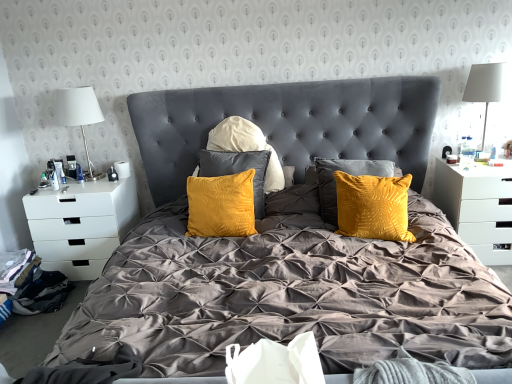
Locate an element on the screen. Image resolution: width=512 pixels, height=384 pixels. white fabric lampshade at upper right, placed as the first table lamp when sorted from right to left is located at coordinates (484, 88).

Locate an element on the screen. The image size is (512, 384). white fabric lampshade at left, which is counted as the first table lamp, starting from the left is located at coordinates (79, 115).

I want to click on white glossy nightstand at right, which is the 1th nightstand from right to left, so click(x=478, y=208).

From a real-world perspective, is black fabric at lower left on top of white glossy nightstand at right, which is the 1th nightstand from right to left?

No, from a real-world perspective, black fabric at lower left is not on top of white glossy nightstand at right, which is the 1th nightstand from right to left.

Which of these two, black fabric at lower left or white glossy nightstand at right, which ranks as the 2th nightstand in left-to-right order, stands taller?

white glossy nightstand at right, which ranks as the 2th nightstand in left-to-right order.

Find the location of `the 2nd nightstand above the black fabric at lower left (from the image's perspective)`. the 2nd nightstand above the black fabric at lower left (from the image's perspective) is located at coordinates (478, 208).

Looking at this image, can white glossy nightstand at right, which is the 1th nightstand from right to left, be found inside black fabric at lower left?

No, white glossy nightstand at right, which is the 1th nightstand from right to left, is not inside black fabric at lower left.

How different are the orientations of white fabric lampshade at upper right, which is the second table lamp from left to right, and velvet yellow pillows at center in degrees?

0.499 degrees separate the facing orientations of white fabric lampshade at upper right, which is the second table lamp from left to right, and velvet yellow pillows at center.

From a real-world perspective, is white fabric lampshade at upper right, which is the second table lamp from left to right, on velvet yellow pillows at center?

Yes, from a real-world perspective, white fabric lampshade at upper right, which is the second table lamp from left to right, is above velvet yellow pillows at center.

From the image's perspective, is white fabric lampshade at upper right, which is the second table lamp from left to right, on top of velvet yellow pillows at center?

Yes, from the image's perspective, white fabric lampshade at upper right, which is the second table lamp from left to right, is over velvet yellow pillows at center.

Do you think white fabric lampshade at upper right, placed as the first table lamp when sorted from right to left, is within velvet yellow pillows at center, or outside of it?

The correct answer is: outside.

Does white fabric lampshade at upper right, which is the second table lamp from left to right, have a greater width compared to white matte drawer at left, which is counted as the second nightstand, starting from the right?

No, white fabric lampshade at upper right, which is the second table lamp from left to right, is not wider than white matte drawer at left, which is counted as the second nightstand, starting from the right.

Which is correct: white fabric lampshade at upper right, placed as the first table lamp when sorted from right to left, is inside white matte drawer at left, which is counted as the second nightstand, starting from the right, or outside of it?

white fabric lampshade at upper right, placed as the first table lamp when sorted from right to left, is not enclosed by white matte drawer at left, which is counted as the second nightstand, starting from the right.

Where is `the 1st table lamp positioned above the white matte drawer at left, which is counted as the second nightstand, starting from the right (from a real-world perspective)`? the 1st table lamp positioned above the white matte drawer at left, which is counted as the second nightstand, starting from the right (from a real-world perspective) is located at coordinates (484, 88).

Who is bigger, white fabric lampshade at upper right, placed as the first table lamp when sorted from right to left, or white matte drawer at left, which is counted as the second nightstand, starting from the right?

Bigger between the two is white matte drawer at left, which is counted as the second nightstand, starting from the right.

Is black fabric at lower left facing away from white fabric lampshade at left, which is counted as the first table lamp, starting from the left?

No, black fabric at lower left is not facing the opposite direction of white fabric lampshade at left, which is counted as the first table lamp, starting from the left.

Considering the sizes of objects black fabric at lower left and white fabric lampshade at left, the 2th table lamp viewed from the right, in the image provided, who is shorter, black fabric at lower left or white fabric lampshade at left, the 2th table lamp viewed from the right,?

With less height is black fabric at lower left.

Is the surface of black fabric at lower left in direct contact with white fabric lampshade at left, which is counted as the first table lamp, starting from the left?

No, black fabric at lower left is not with white fabric lampshade at left, which is counted as the first table lamp, starting from the left.

Is black fabric at lower left not within white fabric lampshade at left, which is counted as the first table lamp, starting from the left?

That's correct, black fabric at lower left is outside of white fabric lampshade at left, which is counted as the first table lamp, starting from the left.

Is white matte drawer at left, which is the first nightstand in left-to-right order, to the left of white fabric lampshade at upper right, placed as the first table lamp when sorted from right to left, from the viewer's perspective?

Correct, you'll find white matte drawer at left, which is the first nightstand in left-to-right order, to the left of white fabric lampshade at upper right, placed as the first table lamp when sorted from right to left.

Is white matte drawer at left, which is the first nightstand in left-to-right order, wider or thinner than white fabric lampshade at upper right, placed as the first table lamp when sorted from right to left?

white matte drawer at left, which is the first nightstand in left-to-right order, is wider than white fabric lampshade at upper right, placed as the first table lamp when sorted from right to left.

From the image's perspective, relative to white fabric lampshade at upper right, which is the second table lamp from left to right, is white matte drawer at left, which is counted as the second nightstand, starting from the right, above or below?

white matte drawer at left, which is counted as the second nightstand, starting from the right, is below white fabric lampshade at upper right, which is the second table lamp from left to right.

The height and width of the screenshot is (384, 512). Find the location of `table lamp in front of the white matte drawer at left, which is the first nightstand in left-to-right order`. table lamp in front of the white matte drawer at left, which is the first nightstand in left-to-right order is located at coordinates (484, 88).

Considering the points (119, 217) and (433, 186), which point is behind, point (119, 217) or point (433, 186)?

The point (433, 186) is farther.

From the image's perspective, is white matte drawer at left, which is counted as the second nightstand, starting from the right, on white glossy nightstand at right, which is the 1th nightstand from right to left?

No.

Between white matte drawer at left, which is counted as the second nightstand, starting from the right, and white glossy nightstand at right, which is the 1th nightstand from right to left, which one has larger width?

→ white glossy nightstand at right, which is the 1th nightstand from right to left.

Is white fabric lampshade at left, the 2th table lamp viewed from the right, at the back of velvet yellow pillows at center?

velvet yellow pillows at center is not turned away from white fabric lampshade at left, the 2th table lamp viewed from the right.

From the image's perspective, which object appears higher, velvet yellow pillows at center or white fabric lampshade at left, the 2th table lamp viewed from the right?

From the image's view, white fabric lampshade at left, the 2th table lamp viewed from the right, is above.

Between velvet yellow pillows at center and white fabric lampshade at left, the 2th table lamp viewed from the right, which one is positioned behind?

white fabric lampshade at left, the 2th table lamp viewed from the right.

Can you tell me how much velvet yellow pillows at center and white fabric lampshade at left, the 2th table lamp viewed from the right, differ in facing direction?

velvet yellow pillows at center and white fabric lampshade at left, the 2th table lamp viewed from the right, are facing 2.89 degrees away from each other.

From a real-world perspective, starting from the black fabric at lower left, which nightstand is the 1st one vertically above it? Please provide its 2D coordinates.

[(478, 208)]

Locate an element on the screen. This screenshot has width=512, height=384. the 1st table lamp behind the velvet yellow pillows at center is located at coordinates (484, 88).

From the image, which object appears to be farther from white fabric lampshade at left, the 2th table lamp viewed from the right, white fabric lampshade at upper right, placed as the first table lamp when sorted from right to left, or white glossy nightstand at right, which is the 1th nightstand from right to left?

The object further to white fabric lampshade at left, the 2th table lamp viewed from the right, is white fabric lampshade at upper right, placed as the first table lamp when sorted from right to left.

Which object lies further to the anchor point white matte drawer at left, which is the first nightstand in left-to-right order, velvet yellow pillows at center or white fabric lampshade at upper right, placed as the first table lamp when sorted from right to left?

white fabric lampshade at upper right, placed as the first table lamp when sorted from right to left, is further to white matte drawer at left, which is the first nightstand in left-to-right order.

Looking at the image, which one is located closer to white fabric lampshade at left, which is counted as the first table lamp, starting from the left, white matte drawer at left, which is counted as the second nightstand, starting from the right, or white glossy nightstand at right, which is the 1th nightstand from right to left?

white matte drawer at left, which is counted as the second nightstand, starting from the right.

From the picture: When comparing their distances from white fabric lampshade at left, which is counted as the first table lamp, starting from the left, does white fabric lampshade at upper right, which is the second table lamp from left to right, or black fabric at lower left seem further?

Based on the image, white fabric lampshade at upper right, which is the second table lamp from left to right, appears to be further to white fabric lampshade at left, which is counted as the first table lamp, starting from the left.

Which object lies further to the anchor point white fabric lampshade at left, which is counted as the first table lamp, starting from the left, black fabric at lower left or white matte drawer at left, which is the first nightstand in left-to-right order?

Among the two, black fabric at lower left is located further to white fabric lampshade at left, which is counted as the first table lamp, starting from the left.

Which object lies further to the anchor point velvet yellow pillows at center, white fabric lampshade at left, which is counted as the first table lamp, starting from the left, or white matte drawer at left, which is counted as the second nightstand, starting from the right?

white fabric lampshade at left, which is counted as the first table lamp, starting from the left, is positioned further to the anchor velvet yellow pillows at center.

Based on the photo, considering their positions, is white fabric lampshade at upper right, placed as the first table lamp when sorted from right to left, positioned closer to black fabric at lower left than white glossy nightstand at right, which is the 1th nightstand from right to left?

The object closer to black fabric at lower left is white glossy nightstand at right, which is the 1th nightstand from right to left.

Based on the photo, based on their spatial positions, is white glossy nightstand at right, which is the 1th nightstand from right to left, or white fabric lampshade at upper right, placed as the first table lamp when sorted from right to left, further from white matte drawer at left, which is counted as the second nightstand, starting from the right?

The object further to white matte drawer at left, which is counted as the second nightstand, starting from the right, is white fabric lampshade at upper right, placed as the first table lamp when sorted from right to left.

At what (x,y) coordinates should I click in order to perform the action: click on bed between black fabric at lower left and white glossy nightstand at right, which ranks as the 2th nightstand in left-to-right order, from left to right. Please return your answer as a coordinate pair (x, y). The height and width of the screenshot is (384, 512). Looking at the image, I should click on (275, 239).

Find the location of a particular element. material between velvet yellow pillows at center and white matte drawer at left, which is counted as the second nightstand, starting from the right, from front to back is located at coordinates (29, 285).

Image resolution: width=512 pixels, height=384 pixels. I want to click on bed between white fabric lampshade at left, which is counted as the first table lamp, starting from the left, and white fabric lampshade at upper right, which is the second table lamp from left to right, in the horizontal direction, so click(x=275, y=239).

At what (x,y) coordinates should I click in order to perform the action: click on table lamp between black fabric at lower left and white fabric lampshade at upper right, placed as the first table lamp when sorted from right to left, in the horizontal direction. Please return your answer as a coordinate pair (x, y). Image resolution: width=512 pixels, height=384 pixels. Looking at the image, I should click on (79, 115).